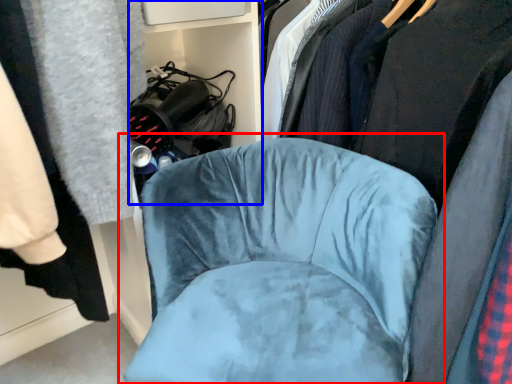
Question: Which of the following is the farthest to the observer, chair (highlighted by a red box) or bookshelf (highlighted by a blue box)?

Choices:
 (A) chair
 (B) bookshelf

Answer: (B)